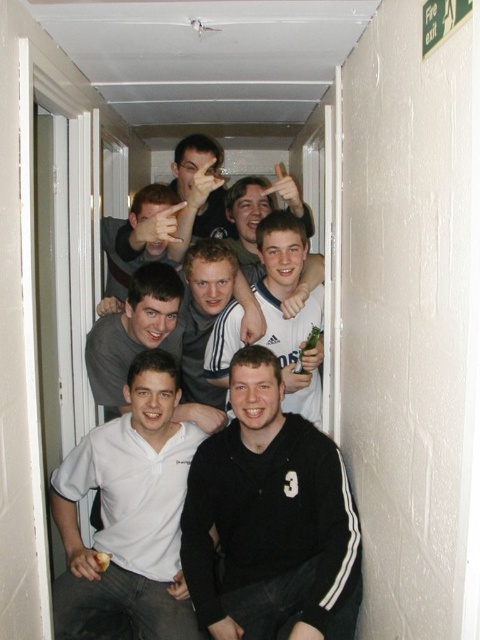
From the picture: Is white matte polo shirt at lower left shorter than white matte shirt at center?

Incorrect, white matte polo shirt at lower left's height does not fall short of white matte shirt at center's.

You are a GUI agent. You are given a task and a screenshot of the screen. Output one action in this format:
    pyautogui.click(x=<x>, y=<y>)
    Task: Click on the white matte polo shirt at lower left
    Image resolution: width=480 pixels, height=640 pixels.
    Given the screenshot: What is the action you would take?
    pyautogui.click(x=130, y=512)

Does black fleece at center have a larger size compared to white matte polo shirt at lower left?

No, black fleece at center is not bigger than white matte polo shirt at lower left.

Which is below, black fleece at center or white matte polo shirt at lower left?

white matte polo shirt at lower left is lower down.

Who is more distant from viewer, (x=231, y=468) or (x=158, y=428)?

Point (x=158, y=428)

Find the location of a particular element. black fleece at center is located at coordinates (269, 516).

Can you confirm if black fleece at center is shorter than white matte shirt at center?

In fact, black fleece at center may be taller than white matte shirt at center.

Which is more to the right, black fleece at center or white matte shirt at center?

From the viewer's perspective, white matte shirt at center appears more on the right side.

Locate an element on the screen. black fleece at center is located at coordinates (269, 516).

This screenshot has height=640, width=480. Identify the location of black fleece at center. (269, 516).